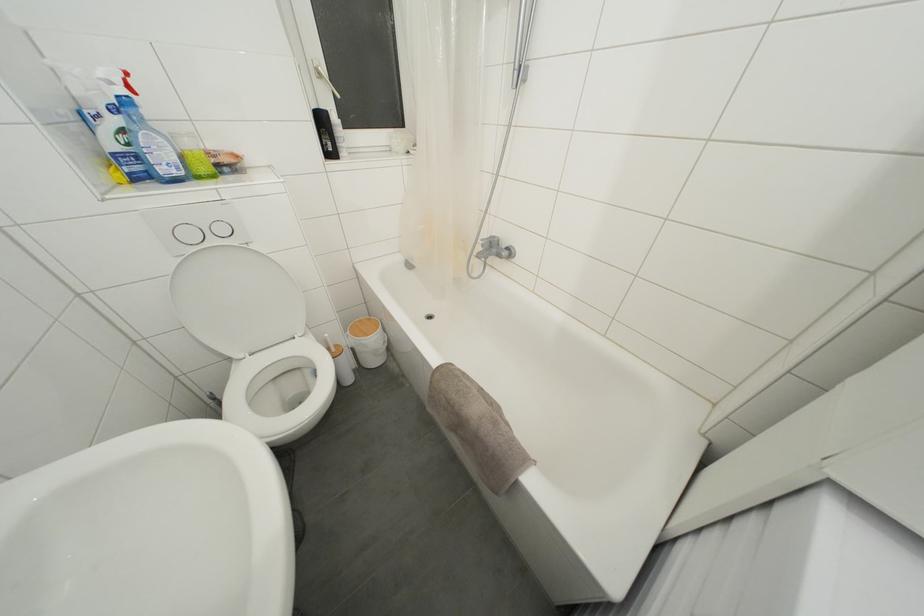
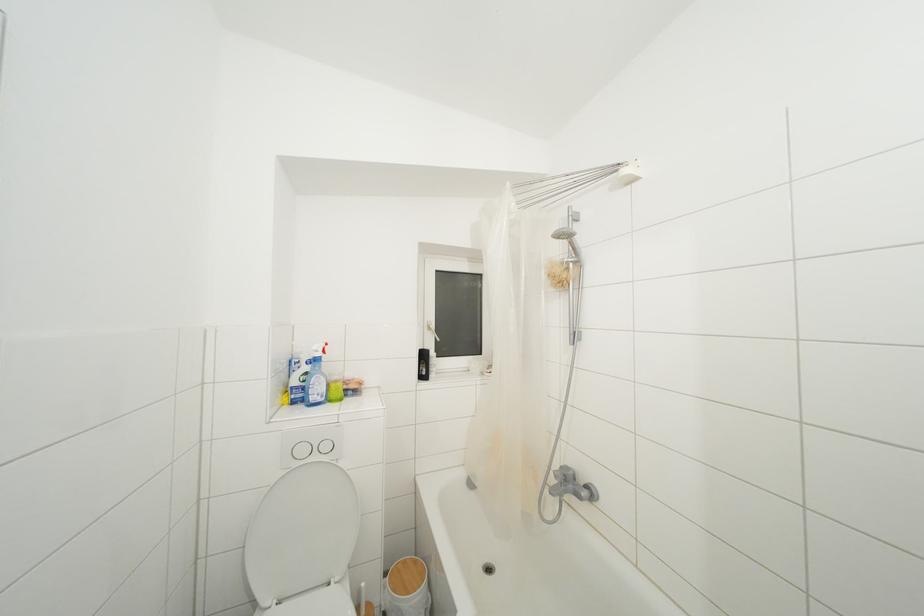
Where in the second image is the point corresponding to pixel 339 351 from the first image?

(371, 610)